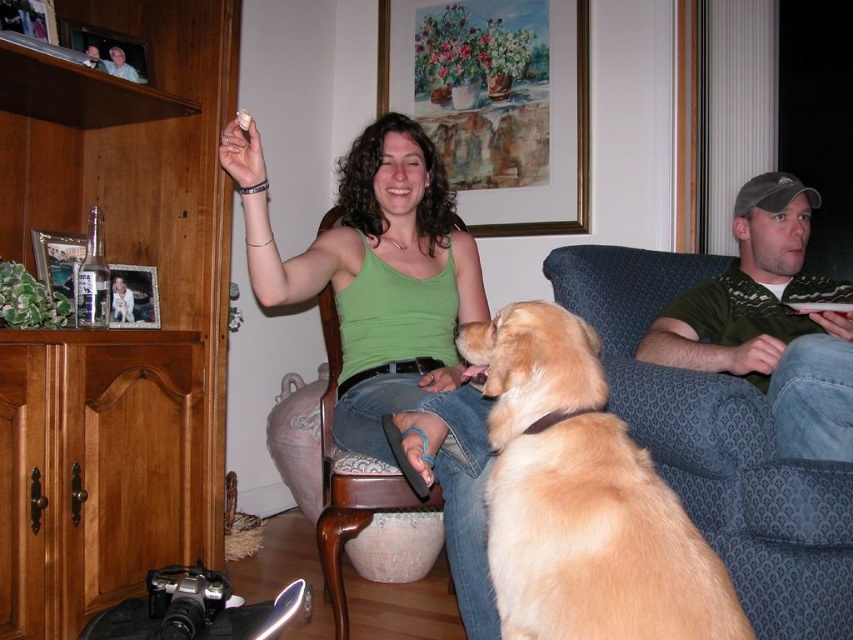
Question: Can you confirm if blue fabric couch at center-right is positioned to the right of green sweater at right?

Choices:
 (A) yes
 (B) no

Answer: (B)

Question: Where is golden fur dog at right located in relation to wooden chair at center in the image?

Choices:
 (A) right
 (B) left

Answer: (A)

Question: Which point is closer to the camera taking this photo?

Choices:
 (A) (323, 326)
 (B) (817, 454)

Answer: (B)

Question: Which object appears closest to the camera in this image?

Choices:
 (A) wooden chair at center
 (B) green tank top at center
 (C) blue fabric couch at center-right

Answer: (C)

Question: Which point is farther to the camera?

Choices:
 (A) (670, 362)
 (B) (585, 520)

Answer: (A)

Question: Does green sweater at right have a larger size compared to wooden chair at center?

Choices:
 (A) yes
 (B) no

Answer: (B)